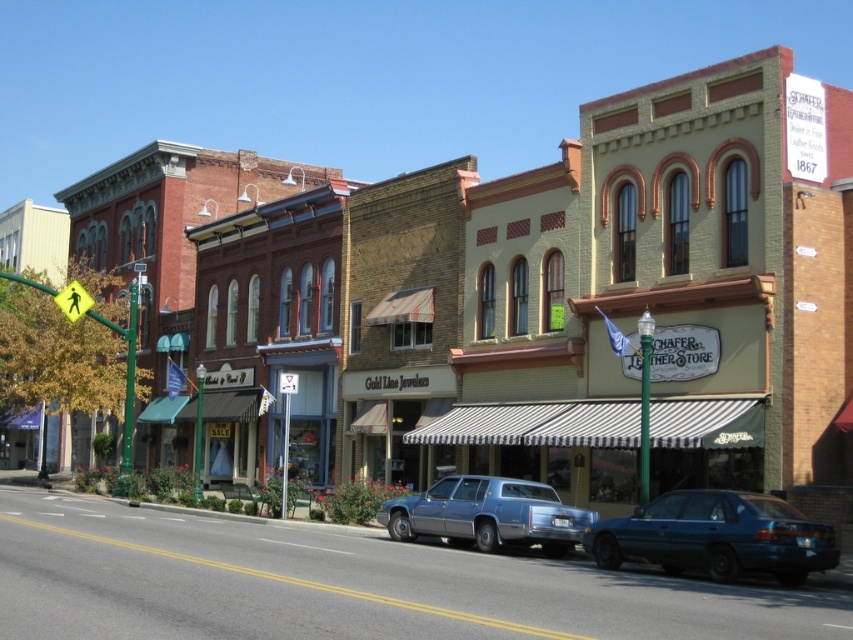
Which is more to the left, teal metallic sedan at center or metallic blue sedan at center?

Positioned to the left is metallic blue sedan at center.

Describe the element at coordinates (717, 536) in the screenshot. Image resolution: width=853 pixels, height=640 pixels. I see `teal metallic sedan at center` at that location.

Is point (733, 557) less distant than point (436, 528)?

Yes, point (733, 557) is closer to viewer.

You are a GUI agent. You are given a task and a screenshot of the screen. Output one action in this format:
    pyautogui.click(x=<x>, y=<y>)
    Task: Click on the teal metallic sedan at center
    This screenshot has height=640, width=853.
    Given the screenshot: What is the action you would take?
    point(717,536)